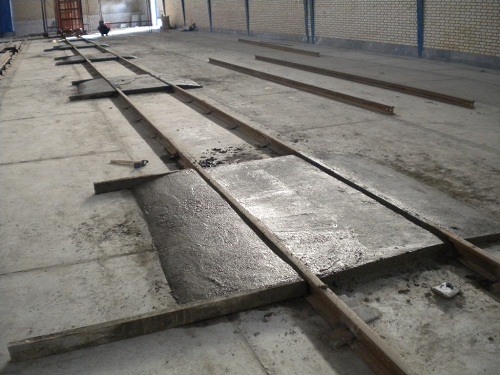
Locate an element on the screen. This screenshot has height=375, width=500. misc equipment in room is located at coordinates (69, 20), (169, 21), (8, 20), (105, 28).